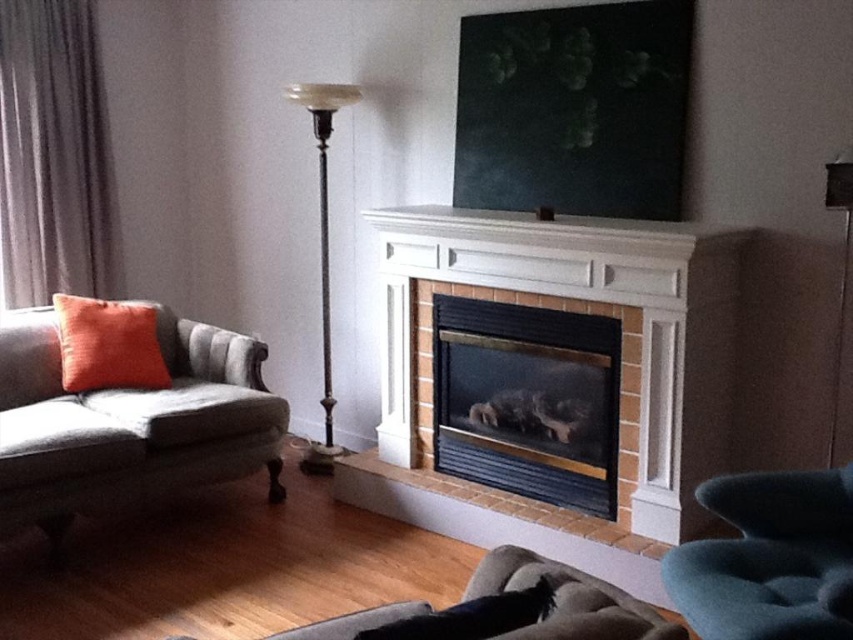
Question: In this image, where is velvet orange pillow at left located relative to orange velvet pillow at left?

Choices:
 (A) below
 (B) above

Answer: (A)

Question: Is dark gray fabric curtain at left below metallic pole at center?

Choices:
 (A) yes
 (B) no

Answer: (B)

Question: Which of these objects is positioned closest to the metallic pole at center?

Choices:
 (A) dark gray fabric curtain at left
 (B) black glass fireplace at center

Answer: (B)

Question: Observing the image, what is the correct spatial positioning of metallic pole at center in reference to black fuzzy pillow at lower center?

Choices:
 (A) right
 (B) left

Answer: (B)

Question: Which of the following is the farthest from the observer?

Choices:
 (A) (326, 454)
 (B) (473, 612)
 (C) (47, 324)
 (D) (57, 308)

Answer: (A)

Question: Which point is closer to the camera?

Choices:
 (A) velvet orange pillow at left
 (B) black glass fireplace at center
 (C) orange velvet pillow at left

Answer: (A)